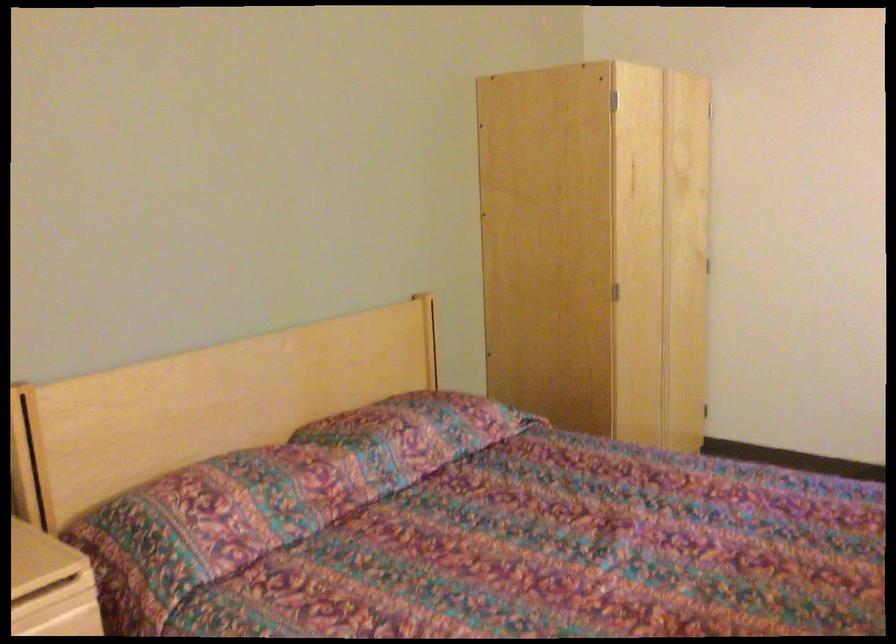
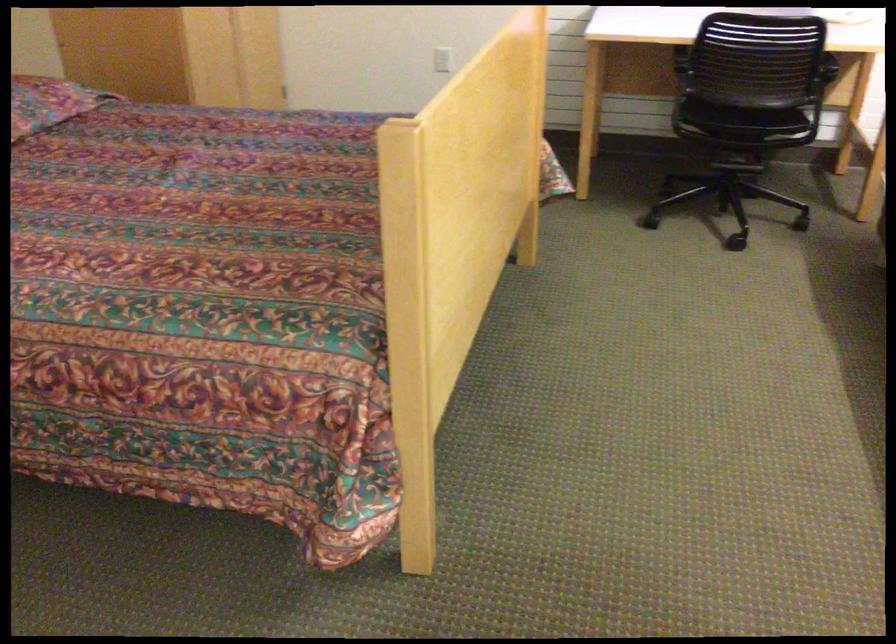
Question: I am providing you with two images of the same scene from different viewpoints. After the viewpoint changes to image2, which objects are now occluded?

Choices:
 (A) chair sitting surface
 (B) patterned pillow
 (C) white light switch
 (D) none of these

Answer: (D)